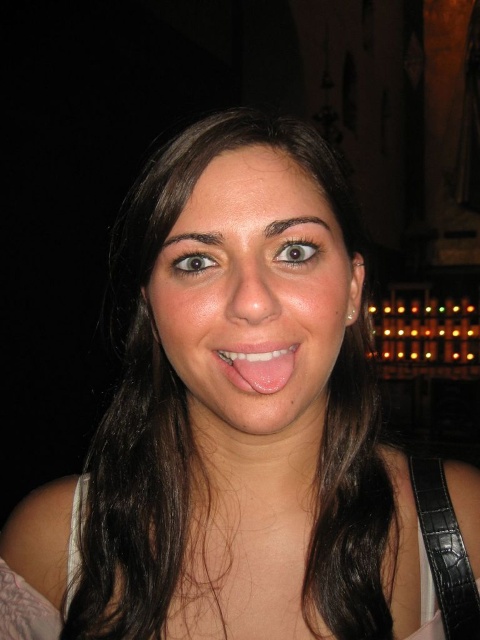
You are a photographer adjusting the camera focus. The black leather strap at lower right and the pink glossy tongue at center are both in the frame. Which object is closer to the camera?

The black leather strap at lower right is 8.93 inches away from the pink glossy tongue at center. Since the distance between them is specified, but the question asks which is closer, the answer must be inferred. However, without knowing the exact distance from the camera to each object, we can only state the separation between them. Therefore, the answer should clarify that the black leather strap is farther than the tongue since the distance is measured from the tongue to the strap. Wait, actually, the phr

You are a photographer setting up a shoot in a dimly lit room with arched structures. You notice the black leather strap at lower right and the pink glossy tongue at center. Which object is located below the other?

The black leather strap at lower right is positioned under the pink glossy tongue at center.

You are a photographer holding a camera at the center. You want to adjust the focus ring on the black leather strap at lower right. Can you reach it without moving your position?

The black leather strap at lower right and camera are 19.25 inches apart from each other. Since the average human arm length is about 25 inches, you can comfortably reach the black leather strap at lower right from your current position.